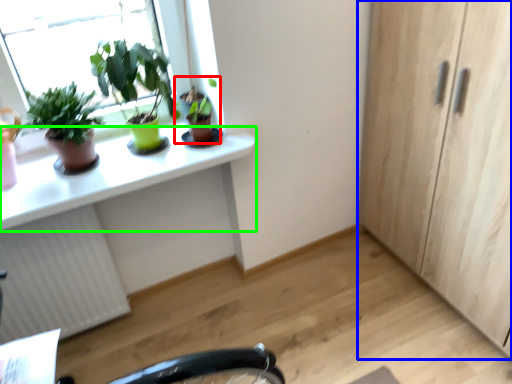
Question: Which object is the farthest from houseplant (highlighted by a red box)? Choose among these: cabinetry (highlighted by a blue box) or desk (highlighted by a green box).

Choices:
 (A) cabinetry
 (B) desk

Answer: (A)